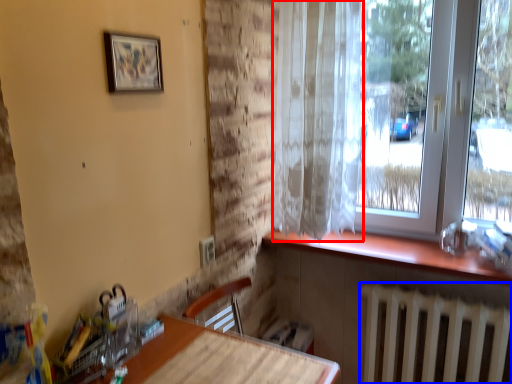
Question: Among these objects, which one is nearest to the camera, curtain (highlighted by a red box) or radiator (highlighted by a blue box)?

Choices:
 (A) curtain
 (B) radiator

Answer: (A)